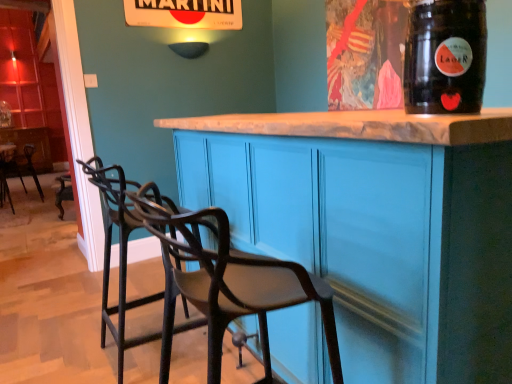
This screenshot has height=384, width=512. Describe the element at coordinates (445, 57) in the screenshot. I see `transparent plastic straw at upper right` at that location.

In order to face black metal bar stool at lower left, which is counted as the 2th chair, starting from the front, should I rotate leftwards or rightwards?

Turn left by 14.277 degrees to look at black metal bar stool at lower left, which is counted as the 2th chair, starting from the front.

In order to click on matte blue cabinet at center in this screenshot , I will do `click(375, 226)`.

Is brushed metal table at left further to the viewer compared to matte blue cabinet at center?

Yes, it is.

Does point (2, 181) come in front of point (244, 155)?

No, (2, 181) is further to viewer.

Considering the relative positions of brushed metal table at left and matte blue cabinet at center in the image provided, is brushed metal table at left to the left or to the right of matte blue cabinet at center?

brushed metal table at left is positioned on matte blue cabinet at center's left side.

Is brushed metal table at left positioned with its back to matte blue cabinet at center?

brushed metal table at left does not have its back to matte blue cabinet at center.

Is transparent plastic straw at upper right not near black metal chair at left, the first chair when ordered from left to right?

That's right, there is a large distance between transparent plastic straw at upper right and black metal chair at left, the first chair when ordered from left to right.

Does transparent plastic straw at upper right have a greater height compared to black metal chair at left, the first chair when ordered from left to right?

In fact, transparent plastic straw at upper right may be shorter than black metal chair at left, the first chair when ordered from left to right.

Which is behind, point (467, 103) or point (5, 149)?

The point (5, 149) is more distant.

Is transparent plastic straw at upper right positioned beyond the bounds of black metal chair at left, the first chair when ordered from left to right?

transparent plastic straw at upper right is positioned outside black metal chair at left, the first chair when ordered from left to right.

Does black metal bar stool at lower left, positioned as the second chair in back-to-front order, turn towards black metal chair at left, marked as the 3th chair in a front-to-back arrangement?

No, black metal bar stool at lower left, positioned as the second chair in back-to-front order, is not oriented towards black metal chair at left, marked as the 3th chair in a front-to-back arrangement.

From the picture: From a real-world perspective, relative to black metal chair at left, which appears as the third chair when viewed from the right, is black metal bar stool at lower left, which is counted as the 2th chair, starting from the front, vertically above or below?

In terms of real-world spatial position, black metal bar stool at lower left, which is counted as the 2th chair, starting from the front, is above black metal chair at left, which appears as the third chair when viewed from the right.

From the black metal chair at left, which appears as the third chair when viewed from the right, count 1st chair to the right and point to it. Please provide its 2D coordinates.

[(119, 252)]

Can you tell me how much black metal bar stool at lower left, positioned as the second chair in back-to-front order, and black metal chair at left, which appears as the third chair when viewed from the right, differ in facing direction?

The facing directions of black metal bar stool at lower left, positioned as the second chair in back-to-front order, and black metal chair at left, which appears as the third chair when viewed from the right, are 176 degrees apart.

Looking at this image, is black metal chair at left, the first chair when ordered from left to right, inside or outside of brushed metal table at left?

black metal chair at left, the first chair when ordered from left to right, is located beyond the bounds of brushed metal table at left.

Is black metal chair at left, which is the 1th chair in back-to-front order, in front of or behind brushed metal table at left in the image?

Clearly, black metal chair at left, which is the 1th chair in back-to-front order, is behind brushed metal table at left.

Between black metal chair at left, the first chair when ordered from left to right, and brushed metal table at left, which one has smaller width?

Thinner between the two is black metal chair at left, the first chair when ordered from left to right.

Is black metal chair at left, the first chair when ordered from left to right, beside brushed metal table at left?

black metal chair at left, the first chair when ordered from left to right, and brushed metal table at left are clearly separated.

Looking at this image, would you say brushed metal table at left is outside black metal chair at left, which appears as the third chair when viewed from the right?

Indeed, brushed metal table at left is completely outside black metal chair at left, which appears as the third chair when viewed from the right.

Considering the sizes of objects brushed metal table at left and black metal chair at left, which appears as the third chair when viewed from the right, in the image provided, who is wider, brushed metal table at left or black metal chair at left, which appears as the third chair when viewed from the right,?

brushed metal table at left is wider.

Where is `chair located on the left of brushed metal table at left`? Image resolution: width=512 pixels, height=384 pixels. chair located on the left of brushed metal table at left is located at coordinates (10, 163).

Is brushed metal table at left far from black metal chair at left, which is the 1th chair in back-to-front order?

No, brushed metal table at left is not far away from black metal chair at left, which is the 1th chair in back-to-front order.

Looking at this image, between transparent plastic straw at upper right and black metal bar stool at lower left, which is counted as the 2th chair, starting from the front, which one appears on the right side from the viewer's perspective?

transparent plastic straw at upper right.

Looking at this image, does transparent plastic straw at upper right turn towards black metal bar stool at lower left, positioned as the second chair in back-to-front order?

No, transparent plastic straw at upper right is not oriented towards black metal bar stool at lower left, positioned as the second chair in back-to-front order.

From the picture: In terms of height, does transparent plastic straw at upper right look taller or shorter compared to black metal bar stool at lower left, positioned as the second chair in back-to-front order?

Considering their sizes, transparent plastic straw at upper right has less height than black metal bar stool at lower left, positioned as the second chair in back-to-front order.

Is transparent plastic straw at upper right smaller than black metal bar stool at lower left, which is counted as the 2th chair, starting from the front?

Indeed, transparent plastic straw at upper right has a smaller size compared to black metal bar stool at lower left, which is counted as the 2th chair, starting from the front.

Is matte blue cabinet at center aimed at black metal chair at left, the first chair when ordered from left to right?

No.

Considering the relative sizes of matte blue cabinet at center and black metal chair at left, which appears as the third chair when viewed from the right, in the image provided, is matte blue cabinet at center bigger than black metal chair at left, which appears as the third chair when viewed from the right,?

Indeed, matte blue cabinet at center has a larger size compared to black metal chair at left, which appears as the third chair when viewed from the right.

How many degrees apart are the facing directions of matte blue cabinet at center and black metal chair at left, the first chair when ordered from left to right?

They differ by 178 degrees in their facing directions.

Measure the distance between matte blue cabinet at center and black metal chair at left, which is the 1th chair in back-to-front order.

matte blue cabinet at center is 5.77 meters away from black metal chair at left, which is the 1th chair in back-to-front order.

Locate an element on the screen. This screenshot has width=512, height=384. cabinetry located in front of the brushed metal table at left is located at coordinates (375, 226).

At what (x,y) coordinates should I click in order to perform the action: click on drinking straw above the black metal chair at left, the first chair when ordered from left to right (from a real-world perspective). Please return your answer as a coordinate pair (x, y). The height and width of the screenshot is (384, 512). Looking at the image, I should click on (445, 57).

Estimate the real-world distances between objects in this image. Which object is closer to black metal bar stool at lower left, acting as the second chair starting from the left, transparent plastic straw at upper right or matte black chair at center, acting as the 3th chair starting from the back?

matte black chair at center, acting as the 3th chair starting from the back, lies closer to black metal bar stool at lower left, acting as the second chair starting from the left, than the other object.

Which object lies further to the anchor point black metal bar stool at lower left, which is the second chair in right-to-left order, brushed metal table at left or matte blue cabinet at center?

brushed metal table at left is further to black metal bar stool at lower left, which is the second chair in right-to-left order.

When comparing their distances from brushed metal table at left, does matte blue cabinet at center or transparent plastic straw at upper right seem closer?

Among the two, matte blue cabinet at center is located nearer to brushed metal table at left.

From the image, which object appears to be nearer to matte blue cabinet at center, black metal bar stool at lower left, positioned as the second chair in back-to-front order, or transparent plastic straw at upper right?

Based on the image, transparent plastic straw at upper right appears to be nearer to matte blue cabinet at center.

Based on their spatial positions, is matte blue cabinet at center or black metal chair at left, which appears as the third chair when viewed from the right, further from brushed metal table at left?

matte blue cabinet at center is further to brushed metal table at left.

Looking at the image, which one is located further to transparent plastic straw at upper right, black metal bar stool at lower left, which is counted as the 2th chair, starting from the front, or brushed metal table at left?

brushed metal table at left.

Based on their spatial positions, is brushed metal table at left or black metal bar stool at lower left, positioned as the second chair in back-to-front order, further from matte blue cabinet at center?

Based on the image, brushed metal table at left appears to be further to matte blue cabinet at center.

Considering their positions, is matte blue cabinet at center positioned closer to transparent plastic straw at upper right than black metal bar stool at lower left, which is counted as the 2th chair, starting from the front?

matte blue cabinet at center.

Identify the location of cabinetry between matte black chair at center, marked as the third chair in a left-to-right arrangement, and black metal chair at left, marked as the 3th chair in a front-to-back arrangement, in the front-back direction. (375, 226).

Locate an element on the screen. table between matte blue cabinet at center and black metal chair at left, the first chair when ordered from left to right, along the z-axis is located at coordinates (5, 172).

Locate an element on the screen. cabinetry between black metal bar stool at lower left, positioned as the second chair in back-to-front order, and transparent plastic straw at upper right is located at coordinates (375, 226).

Locate an element on the screen. This screenshot has width=512, height=384. cabinetry between matte black chair at center, marked as the third chair in a left-to-right arrangement, and black metal bar stool at lower left, which is counted as the 2th chair, starting from the front, in the front-back direction is located at coordinates (375, 226).